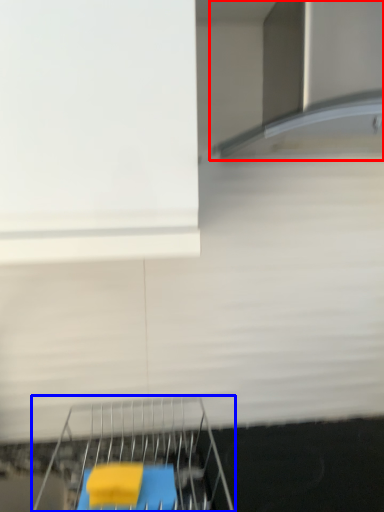
Question: Which of the following is the farthest to the observer, exhaust hood (highlighted by a red box) or furniture (highlighted by a blue box)?

Choices:
 (A) exhaust hood
 (B) furniture

Answer: (B)